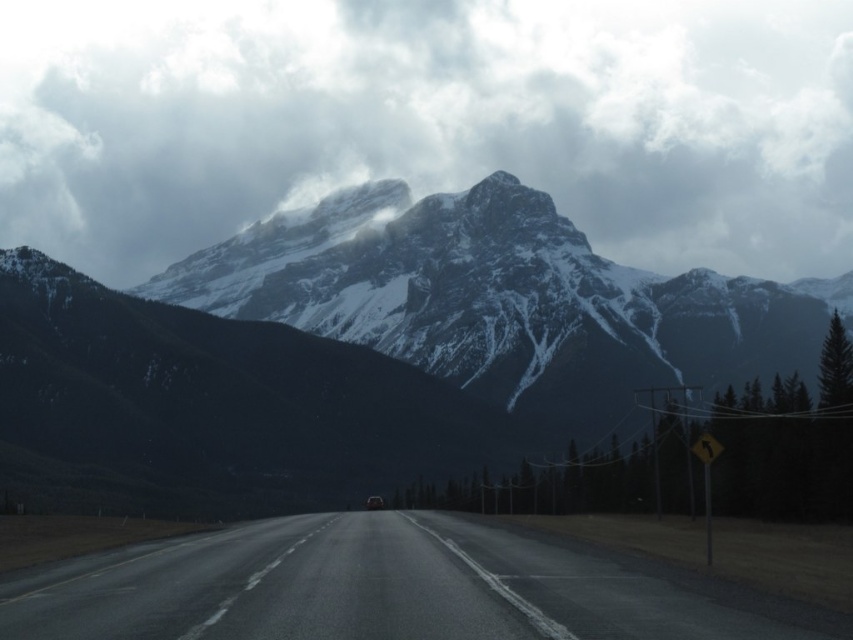
Can you confirm if snowy granite mountain range at upper center is thinner than shiny silver car at center?

No, snowy granite mountain range at upper center is not thinner than shiny silver car at center.

Is snowy granite mountain range at upper center to the left of shiny silver car at center from the viewer's perspective?

No, snowy granite mountain range at upper center is not to the left of shiny silver car at center.

Looking at this image, measure the distance between snowy granite mountain range at upper center and camera.

snowy granite mountain range at upper center and camera are 636.37 meters apart.

Identify the location of snowy granite mountain range at upper center. (376, 339).

Does asphalt road at center have a greater width compared to shiny silver car at center?

Yes, asphalt road at center is wider than shiny silver car at center.

Can you confirm if asphalt road at center is positioned to the left of shiny silver car at center?

No, asphalt road at center is not to the left of shiny silver car at center.

Image resolution: width=853 pixels, height=640 pixels. What do you see at coordinates (390, 588) in the screenshot? I see `asphalt road at center` at bounding box center [390, 588].

Find the location of a particular element. asphalt road at center is located at coordinates (390, 588).

Who is taller, snowy rock formation at upper center or shiny silver car at center?

Standing taller between the two is snowy rock formation at upper center.

Which is behind, point (28, 125) or point (379, 500)?

The point (28, 125) is behind.

Locate an element on the screen. The image size is (853, 640). snowy rock formation at upper center is located at coordinates (430, 122).